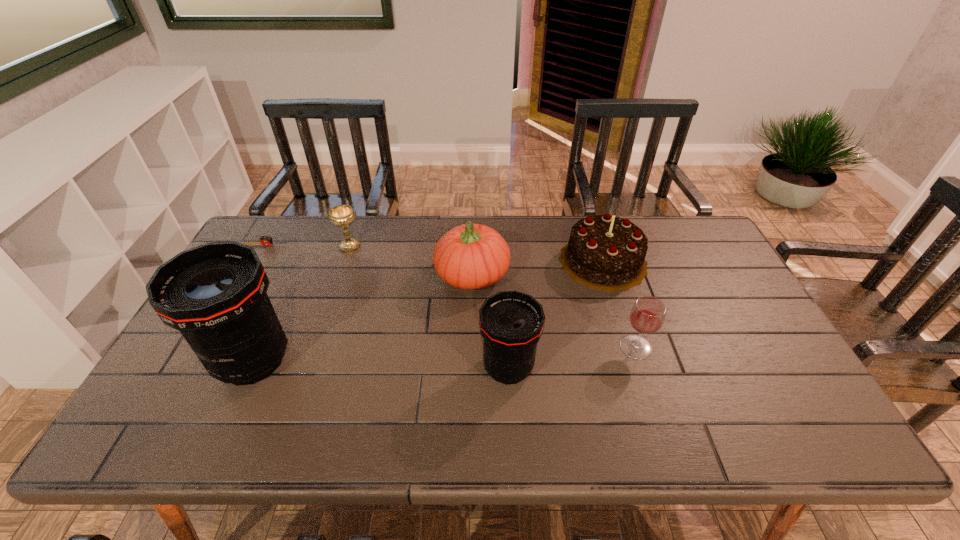
Where is `tape measure situated at the left edge`? This screenshot has height=540, width=960. tape measure situated at the left edge is located at coordinates (265, 240).

Identify the location of object that is at the far left corner. The image size is (960, 540). (265, 240).

Find the location of `object present at the near left corner`. object present at the near left corner is located at coordinates (215, 294).

This screenshot has width=960, height=540. What are the coordinates of `free space at the far edge of the desktop` in the screenshot? It's located at (441, 237).

The height and width of the screenshot is (540, 960). What are the coordinates of `free space at the near edge of the desktop` in the screenshot? It's located at (228, 402).

In the image, there is a desktop. Where is `vacant space at the right edge`? The width and height of the screenshot is (960, 540). vacant space at the right edge is located at coordinates (713, 280).

Locate an element on the screen. The height and width of the screenshot is (540, 960). vacant space at the far left corner is located at coordinates (284, 219).

In the image, there is a desktop. Where is `free space at the far right corner`? This screenshot has width=960, height=540. free space at the far right corner is located at coordinates (692, 256).

Find the location of a particular element. The height and width of the screenshot is (540, 960). empty location between the chalice and the tallest object is located at coordinates (301, 303).

Where is `unoccupied position between the pumpkin and the birthday cake`? The width and height of the screenshot is (960, 540). unoccupied position between the pumpkin and the birthday cake is located at coordinates (538, 268).